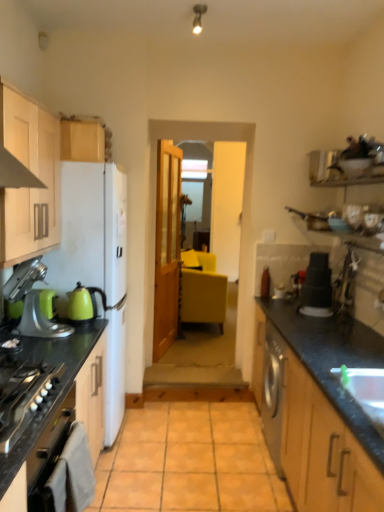
Question: Is black granite countertop at left, acting as the second countertop starting from the right, at the right side of matte black stack at right?

Choices:
 (A) yes
 (B) no

Answer: (B)

Question: From a real-world perspective, is black granite countertop at left, acting as the first countertop starting from the left, physically above matte black stack at right?

Choices:
 (A) no
 (B) yes

Answer: (A)

Question: Considering the relative sizes of black granite countertop at left, acting as the first countertop starting from the left, and matte black stack at right in the image provided, is black granite countertop at left, acting as the first countertop starting from the left, taller than matte black stack at right?

Choices:
 (A) yes
 (B) no

Answer: (A)

Question: Is black granite countertop at left, acting as the second countertop starting from the right, oriented towards matte black stack at right?

Choices:
 (A) yes
 (B) no

Answer: (A)

Question: Can you confirm if black granite countertop at left, acting as the second countertop starting from the right, is wider than matte black stack at right?

Choices:
 (A) no
 (B) yes

Answer: (B)

Question: Is white glossy sink at lower right situated inside clear glass door at center or outside?

Choices:
 (A) inside
 (B) outside

Answer: (B)

Question: Considering the positions of point (364, 382) and point (244, 352), is point (364, 382) closer or farther from the camera than point (244, 352)?

Choices:
 (A) closer
 (B) farther

Answer: (A)

Question: Is white glossy sink at lower right taller or shorter than clear glass door at center?

Choices:
 (A) short
 (B) tall

Answer: (A)

Question: From the image's perspective, is white glossy sink at lower right above or below clear glass door at center?

Choices:
 (A) below
 (B) above

Answer: (A)

Question: Considering the positions of clear glass door at center and orange tile at center in the image, is clear glass door at center taller or shorter than orange tile at center?

Choices:
 (A) short
 (B) tall

Answer: (B)

Question: From a real-world perspective, relative to orange tile at center, is clear glass door at center vertically above or below?

Choices:
 (A) above
 (B) below

Answer: (A)

Question: Is clear glass door at center in front of or behind orange tile at center in the image?

Choices:
 (A) front
 (B) behind

Answer: (B)

Question: From the image's perspective, relative to orange tile at center, is clear glass door at center above or below?

Choices:
 (A) below
 (B) above

Answer: (B)

Question: Would you say matte yellow chair at center is inside or outside matte wood cabinets at left, the second cabinetry when ordered from back to front?

Choices:
 (A) inside
 (B) outside

Answer: (B)

Question: In the image, is matte yellow chair at center positioned in front of or behind matte wood cabinets at left, which appears as the 1th cabinetry when viewed from the front?

Choices:
 (A) behind
 (B) front

Answer: (A)